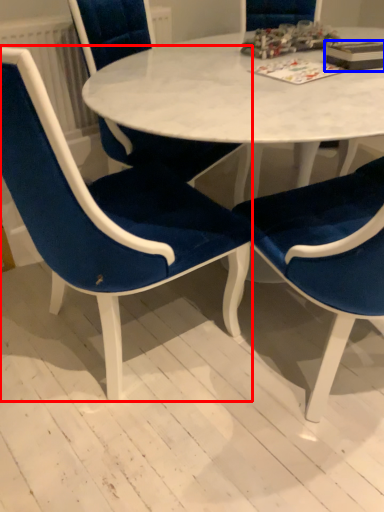
Question: Among these objects, which one is nearest to the camera, chair (highlighted by a red box) or book (highlighted by a blue box)?

Choices:
 (A) chair
 (B) book

Answer: (A)